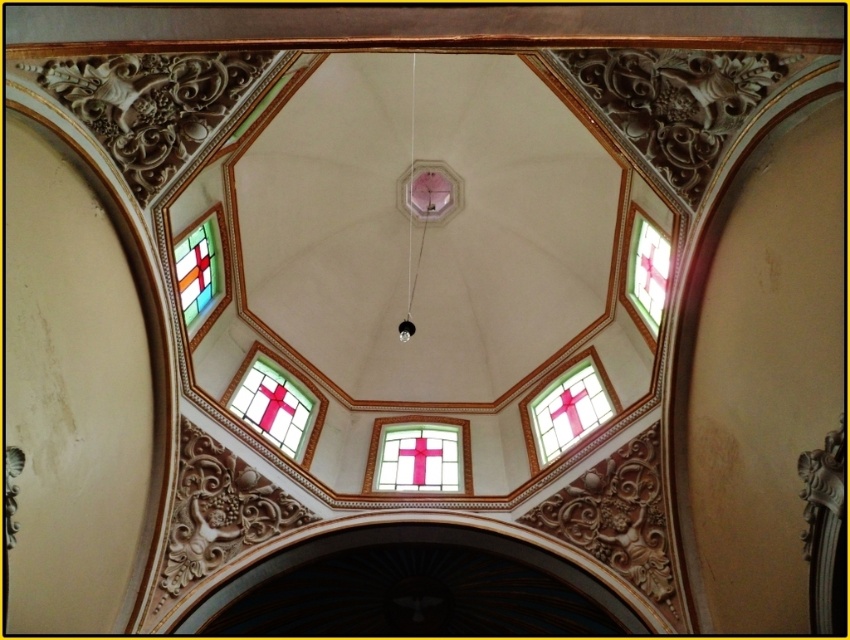
You are standing at the base of the dome in the cathedral and want to reach both the pink stained glass cross at center and the pink stained glass cross at upper center. Which one is farther from your current position?

The pink stained glass cross at upper center is farther away from your current position since the pink stained glass cross at center is only 15.20 meters away from it, meaning the upper one is further up the dome.

You are standing at the entrance of the cathedral and looking up at the dome ceiling. You see the pink stained glass cross at upper center and the stained glass window at upper left. Which one appears closer to you from your viewing position?

The pink stained glass cross at upper center appears closer to you because the stained glass window at upper left is behind it.

You are an architect examining the dome ceiling. You see the pink stained glass cross at center and the clear glass cross at lower left. Which one is positioned higher up in the dome?

The clear glass cross at lower left is positioned higher up in the dome than the pink stained glass cross at center.